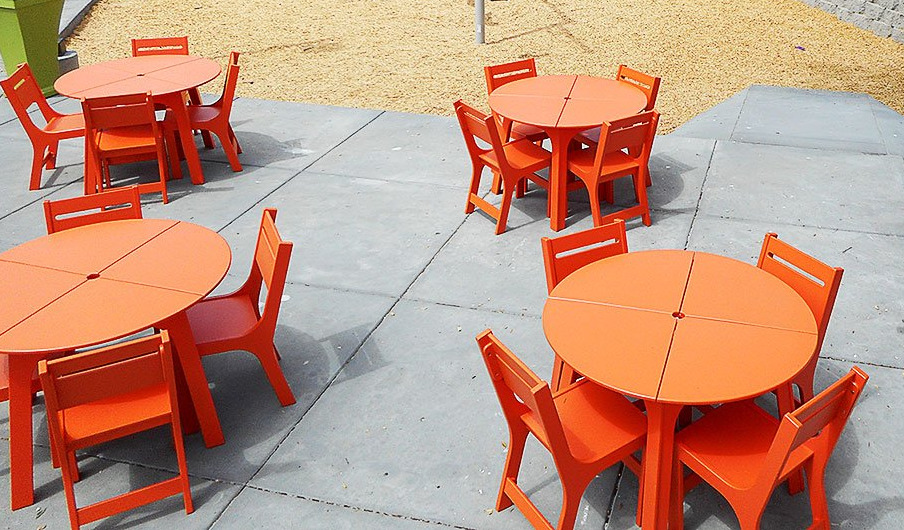
Locate an element on the screen. The width and height of the screenshot is (904, 530). tables is located at coordinates (82, 262), (665, 316), (579, 99), (149, 74).